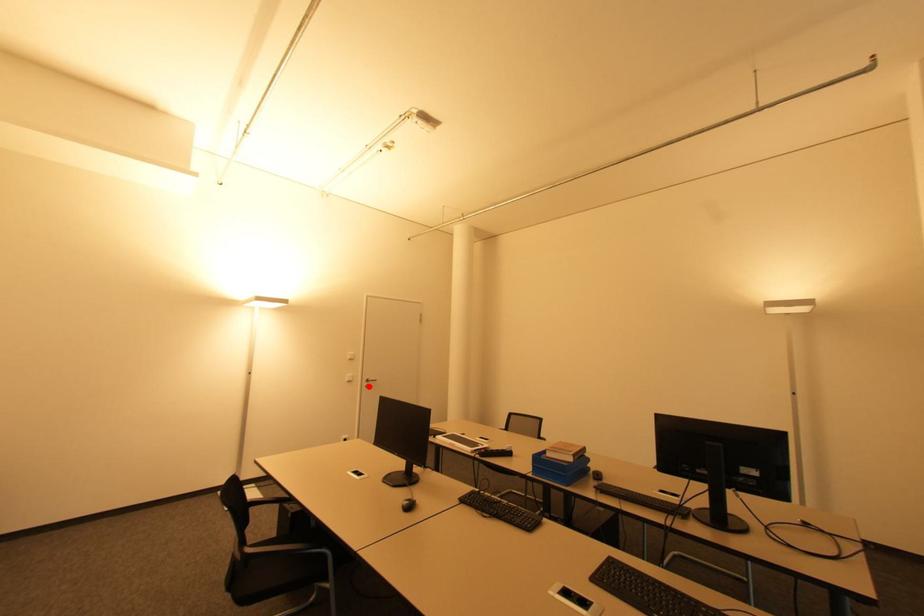
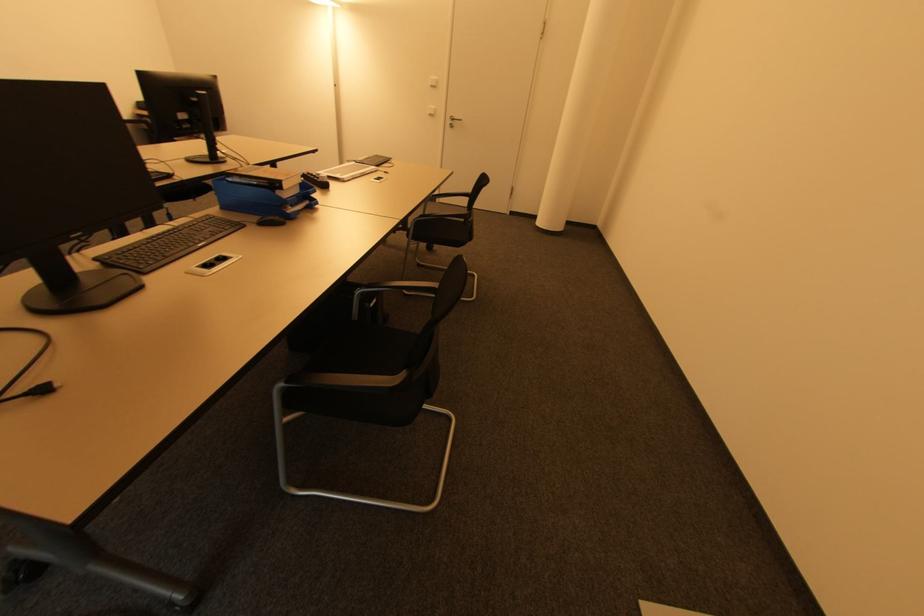
Question: A red point is marked in image1. In image2, is the corresponding 3D point closer to the camera or farther? Reply with the corresponding letter.

Choices:
 (A) The corresponding 3D point is closer.
 (B) The corresponding 3D point is farther.

Answer: (A)